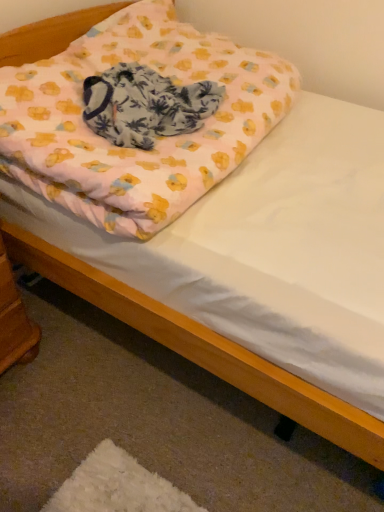
Locate an element on the screen. vacant area that lies to the right of wooden changing table at lower left is located at coordinates (64, 358).